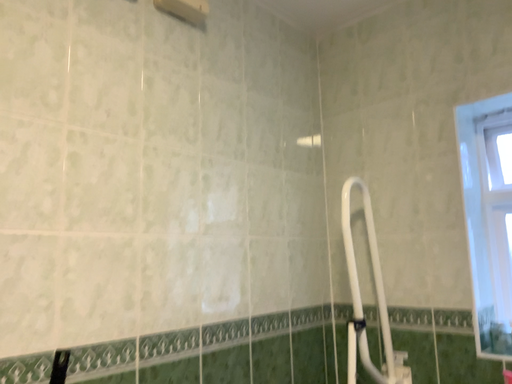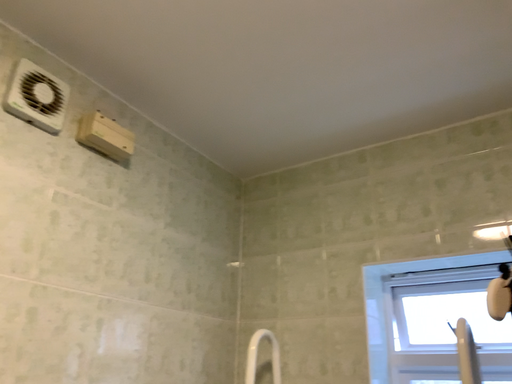
Question: How did the camera likely rotate when shooting the video?

Choices:
 (A) rotated upward
 (B) rotated downward

Answer: (A)